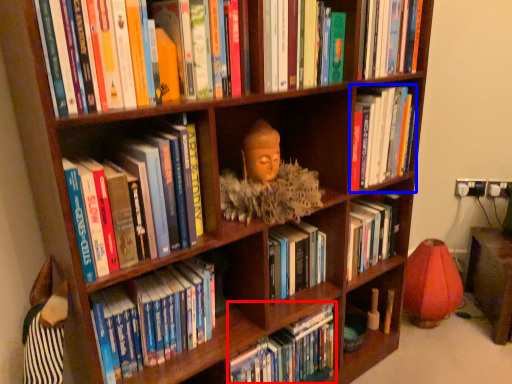
Question: Which of the following is the closest to the observer, book (highlighted by a red box) or book (highlighted by a blue box)?

Choices:
 (A) book
 (B) book

Answer: (A)